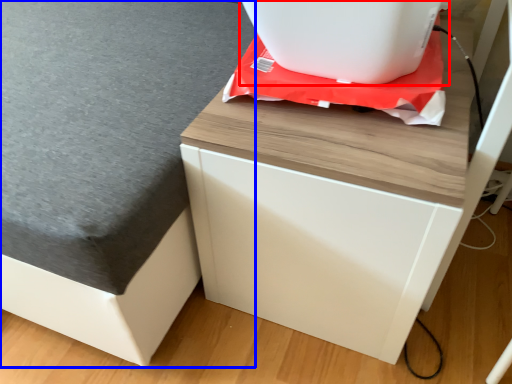
Question: Among these objects, which one is farthest to the camera, appliance (highlighted by a red box) or table top (highlighted by a blue box)?

Choices:
 (A) appliance
 (B) table top

Answer: (A)